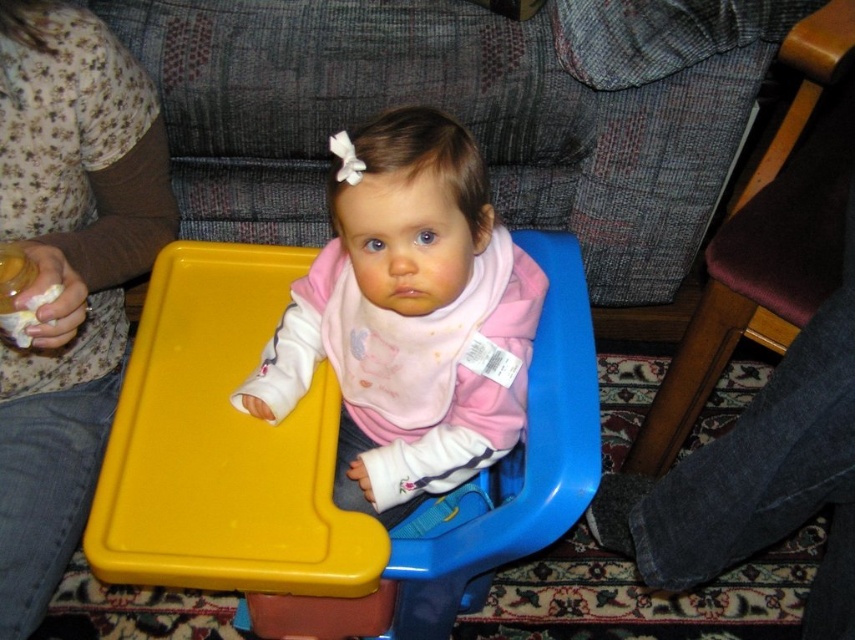
Can you confirm if pink matte bib at center is wider than wooden chair at right?

Incorrect, pink matte bib at center's width does not surpass wooden chair at right's.

Does pink matte bib at center have a lesser height compared to wooden chair at right?

Correct, pink matte bib at center is not as tall as wooden chair at right.

Which is behind, point (385, 237) or point (747, 189)?

The point (747, 189) is more distant.

I want to click on pink matte bib at center, so click(x=410, y=317).